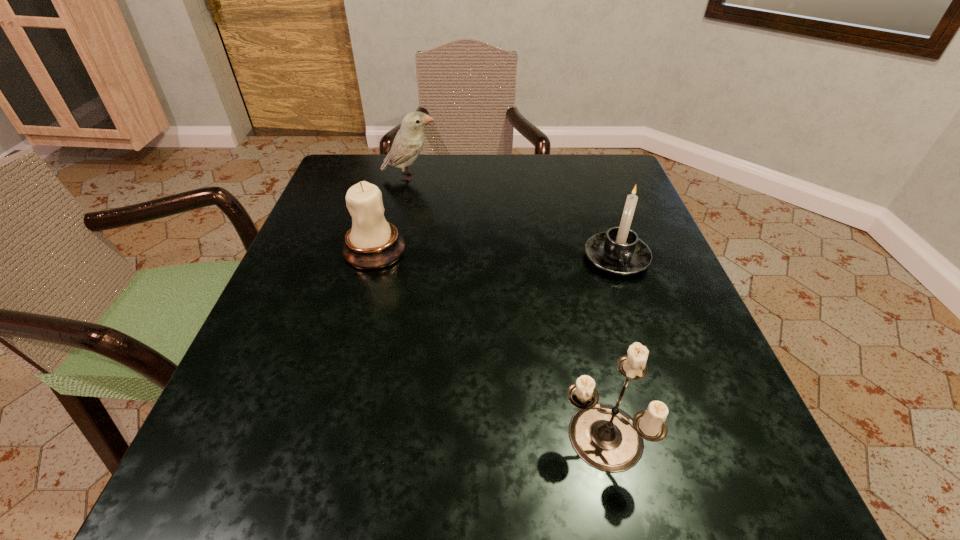
Find the location of a particular element. free location that satisfies the following two spatial constraints: 1. on the front side of the nearest object; 2. on the left side of the leftmost candle holder is located at coordinates (324, 436).

Locate an element on the screen. This screenshot has width=960, height=540. vacant space that satisfies the following two spatial constraints: 1. at the face of the farthest object; 2. on the front side of the leftmost candle holder is located at coordinates pos(394,251).

In order to click on free location that satisfies the following two spatial constraints: 1. at the face of the bird; 2. on the front side of the leftmost candle holder in this screenshot , I will do `click(394, 251)`.